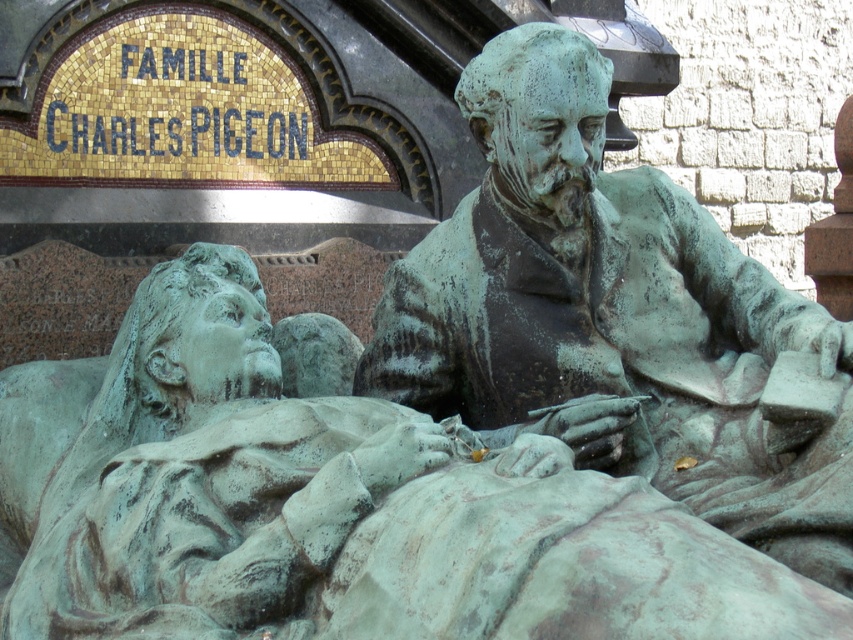
Question: Which object appears farthest from the camera in this image?

Choices:
 (A) green patinated bronze statue at upper center
 (B) green patinated bronze statue at center

Answer: (B)

Question: Which point is farther to the camera?

Choices:
 (A) green patinated bronze statue at upper center
 (B) green patinated bronze statue at center

Answer: (B)

Question: Can you confirm if green patinated bronze statue at upper center is positioned to the right of green patinated bronze statue at center?

Choices:
 (A) no
 (B) yes

Answer: (A)

Question: Which of the following is the closest to the observer?

Choices:
 (A) green patinated bronze statue at upper center
 (B) green patinated bronze statue at center

Answer: (A)

Question: Can you confirm if green patinated bronze statue at upper center is bigger than green patinated bronze statue at center?

Choices:
 (A) no
 (B) yes

Answer: (B)

Question: Can you confirm if green patinated bronze statue at upper center is positioned below green patinated bronze statue at center?

Choices:
 (A) no
 (B) yes

Answer: (B)